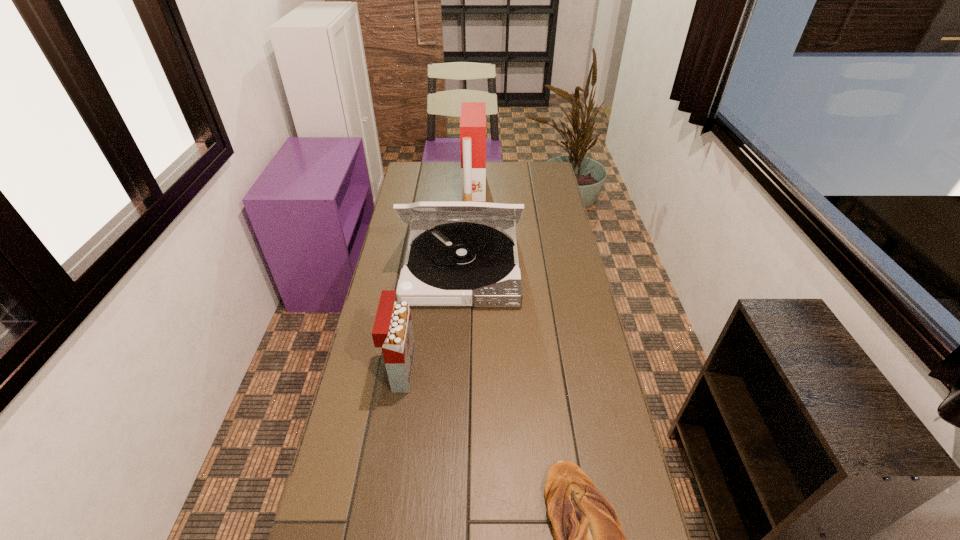
Where is `cigarette case that is at the left edge`? cigarette case that is at the left edge is located at coordinates (392, 331).

The width and height of the screenshot is (960, 540). Identify the location of vacant space at the far edge. (456, 166).

Locate an element on the screen. This screenshot has width=960, height=540. free spot at the left edge of the desktop is located at coordinates (414, 199).

Locate an element on the screen. This screenshot has height=540, width=960. vacant space at the right edge is located at coordinates (603, 414).

This screenshot has height=540, width=960. Identify the location of object that is the closest to the rightmost object. (392, 331).

Point out which object is positioned as the nearest to the right cigarette case. Please provide its 2D coordinates. Your answer should be formatted as a tuple, i.e. [(x, y)], where the tuple contains the x and y coordinates of a point satisfying the conditions above.

[(465, 260)]

Find the location of a particular element. This screenshot has width=960, height=540. free space that satisfies the following two spatial constraints: 1. on the front-facing side of the right cigarette case; 2. on the control panel of the CD player is located at coordinates (472, 266).

This screenshot has height=540, width=960. What are the coordinates of `free location that satisfies the following two spatial constraints: 1. on the front-facing side of the farthest object; 2. on the control panel of the third nearest object` in the screenshot? It's located at (472, 266).